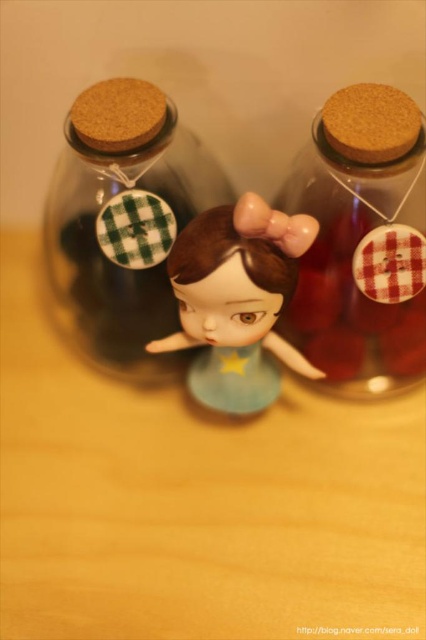
In the scene shown: You are organizing a display and need to place the red plaid cork at right and the matte plastic doll at center. Based on their sizes, which object should you place first to ensure both fit properly?

The red plaid cork at right occupies less space than the matte plastic doll at center, so you should place the matte plastic doll at center first to ensure there is enough space for both.

You are arranging items on a shelf and need to know the spatial relationship between the red plaid cork at right and the transparent glass jar at center. Which one is closer to the front?

The red plaid cork at right is in front of the transparent glass jar at center, so it is closer to the front.